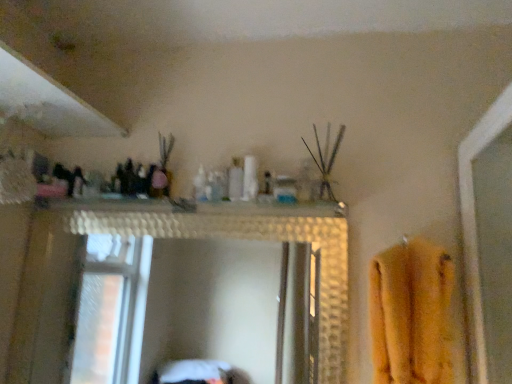
Question: Considering the positions of white glossy shelf at upper center and yellow fuzzy bath towel at right in the image, is white glossy shelf at upper center taller or shorter than yellow fuzzy bath towel at right?

Choices:
 (A) short
 (B) tall

Answer: (A)

Question: Is white glossy shelf at upper center in front of or behind yellow fuzzy bath towel at right in the image?

Choices:
 (A) behind
 (B) front

Answer: (A)

Question: Based on their relative distances, which object is nearer to the translucent plastic bottle at center?

Choices:
 (A) yellow fuzzy bath towel at right
 (B) white glossy shelf at upper center

Answer: (B)

Question: Considering the real-world distances, which object is closest to the yellow fuzzy bath towel at right?

Choices:
 (A) white glossy shelf at upper center
 (B) translucent plastic bottle at center

Answer: (A)